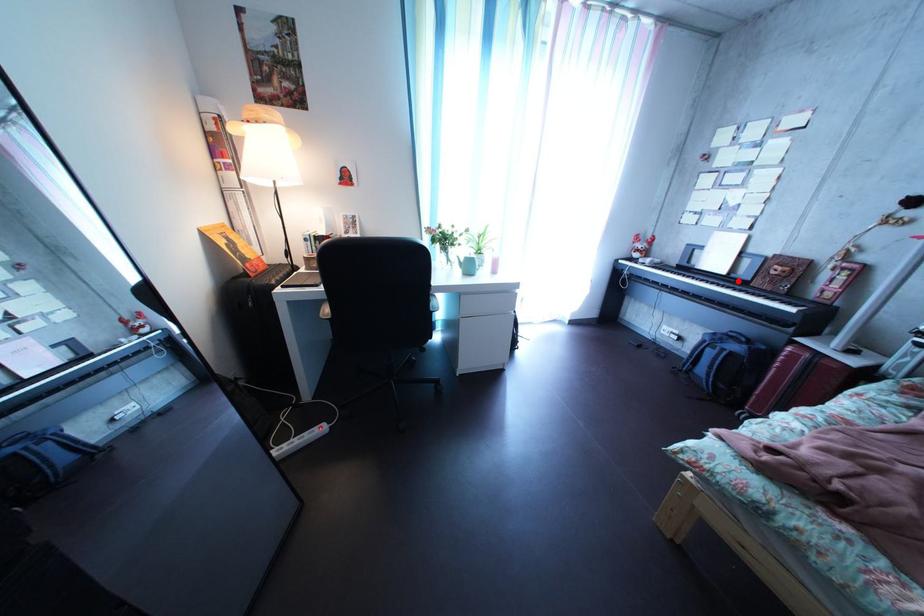
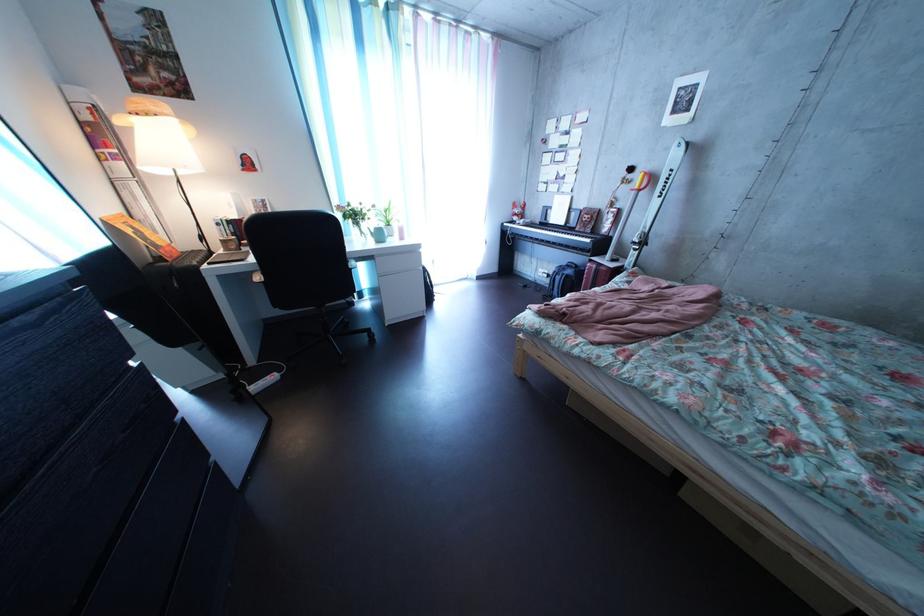
Question: I am providing you with two images of the same scene from different viewpoints. Image1 has a red point marked. In image2, the corresponding 3D location appears at what relative position? Reply with the corresponding letter.

Choices:
 (A) Closer
 (B) Farther

Answer: (A)